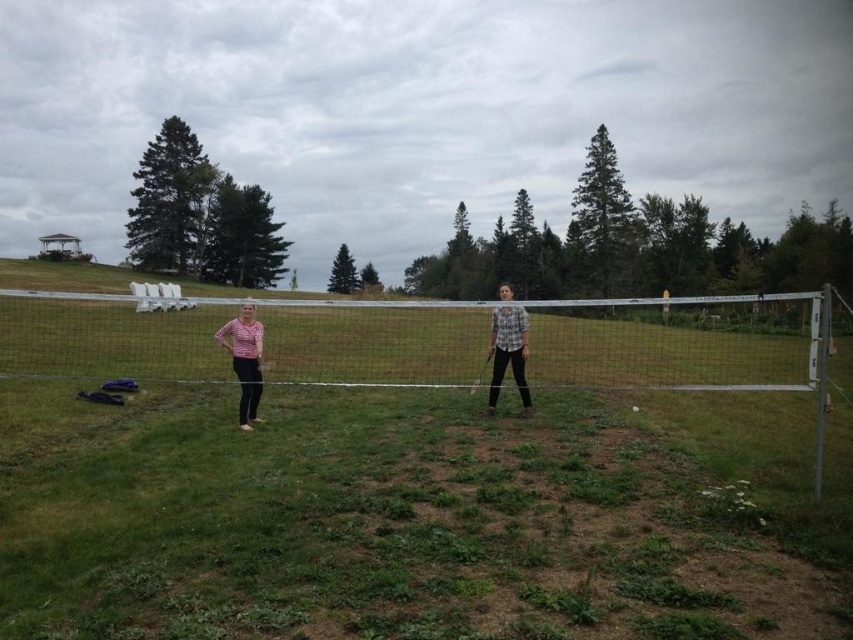
Question: Can you confirm if white mesh net at center is thinner than plaid shirt at center?

Choices:
 (A) no
 (B) yes

Answer: (A)

Question: Which point is farther from the camera taking this photo?

Choices:
 (A) (367, 316)
 (B) (241, 346)
 (C) (523, 321)

Answer: (A)

Question: Observing the image, what is the correct spatial positioning of white mesh net at center in reference to striped cotton shirt at left?

Choices:
 (A) left
 (B) right

Answer: (B)

Question: Does white mesh net at center appear on the left side of striped cotton shirt at left?

Choices:
 (A) yes
 (B) no

Answer: (B)

Question: Which point is closer to the camera?

Choices:
 (A) (257, 342)
 (B) (490, 332)
 (C) (701, 308)

Answer: (A)

Question: Which of the following is the closest to the observer?

Choices:
 (A) (248, 305)
 (B) (517, 380)

Answer: (A)